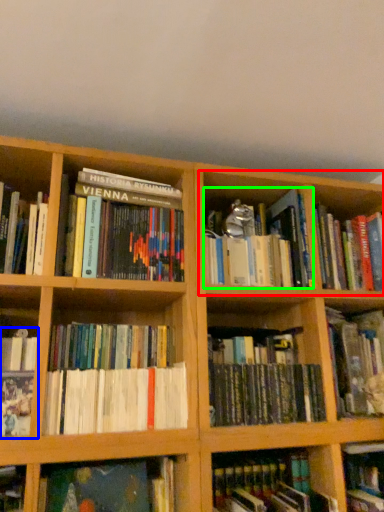
Question: Based on their relative distances, which object is farther from cabinet (highlighted by a red box)? Choose from book (highlighted by a blue box) and book (highlighted by a green box).

Choices:
 (A) book
 (B) book

Answer: (A)